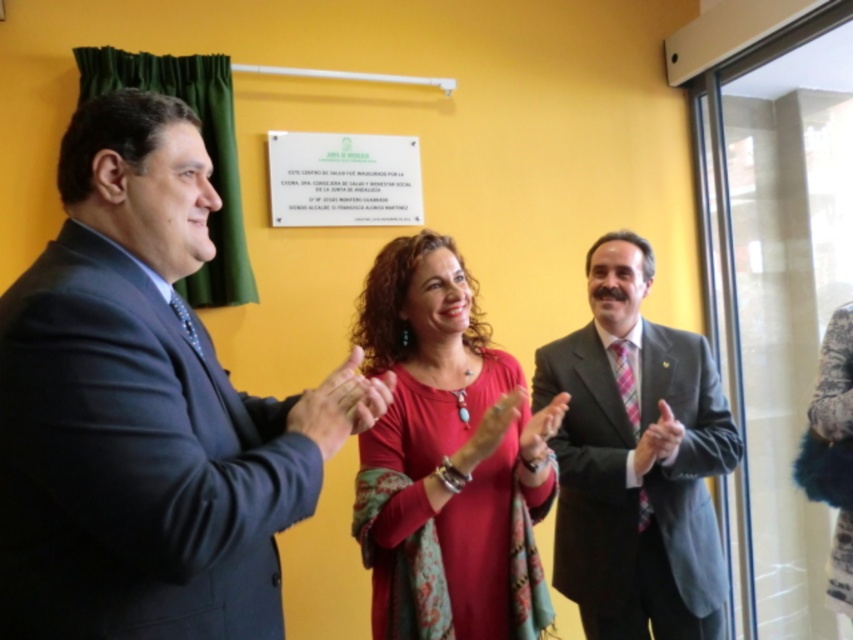
Question: Which object is the farthest from the matte gray suit at center?

Choices:
 (A) fuzzy gray coat at center
 (B) white matte plaque at upper center
 (C) smooth black suit at center
 (D) smooth skin hand at center

Answer: (B)

Question: Which point is closer to the camera taking this photo?

Choices:
 (A) (194, 497)
 (B) (686, 522)
 (C) (657, 460)

Answer: (A)

Question: Can you confirm if matte black suit at left is positioned to the right of matte red blouse at center?

Choices:
 (A) yes
 (B) no

Answer: (B)

Question: From the image, what is the correct spatial relationship of matte red blouse at center in relation to matte gray suit at center?

Choices:
 (A) above
 (B) below

Answer: (A)

Question: Is white matte plaque at upper center positioned at the back of smooth leather hand at center?

Choices:
 (A) yes
 (B) no

Answer: (A)

Question: Which point is farther to the camera?

Choices:
 (A) matte gray suit at center
 (B) smooth leather hand at center
 (C) matte red blouse at center

Answer: (A)